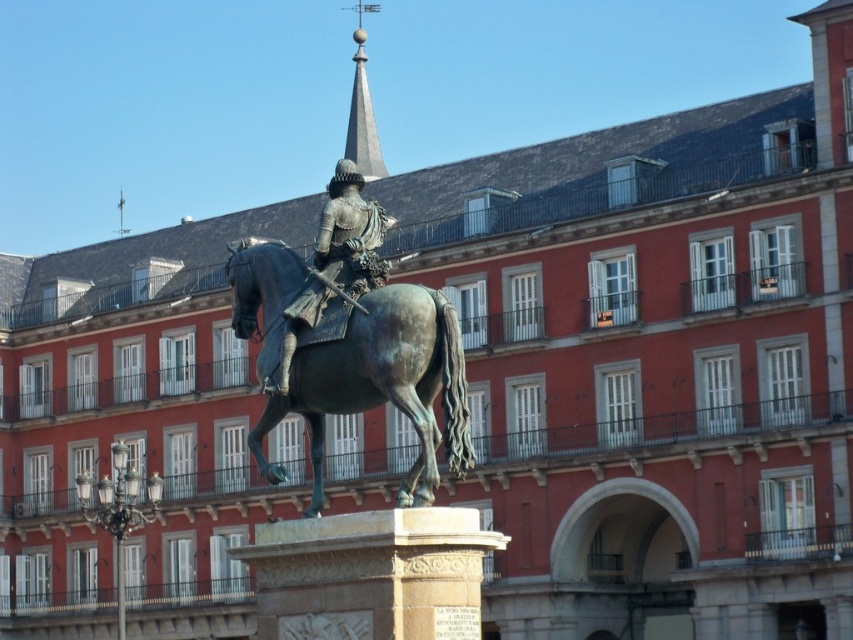
Question: Estimate the real-world distances between objects in this image. Which object is closer to the shiny bronze rider at center?

Choices:
 (A) bronze textured horse at center
 (B) polished gray spire at upper center

Answer: (A)

Question: Which object is closer to the camera taking this photo?

Choices:
 (A) shiny bronze rider at center
 (B) bronze textured horse at center

Answer: (B)

Question: Can you confirm if bronze textured horse at center is wider than polished gray spire at upper center?

Choices:
 (A) yes
 (B) no

Answer: (A)

Question: Based on their relative distances, which object is farther from the bronze textured horse at center?

Choices:
 (A) shiny bronze rider at center
 (B) polished gray spire at upper center

Answer: (B)

Question: Is bronze textured horse at center to the right of polished gray spire at upper center from the viewer's perspective?

Choices:
 (A) yes
 (B) no

Answer: (A)

Question: Does bronze textured horse at center appear on the left side of polished gray spire at upper center?

Choices:
 (A) yes
 (B) no

Answer: (B)